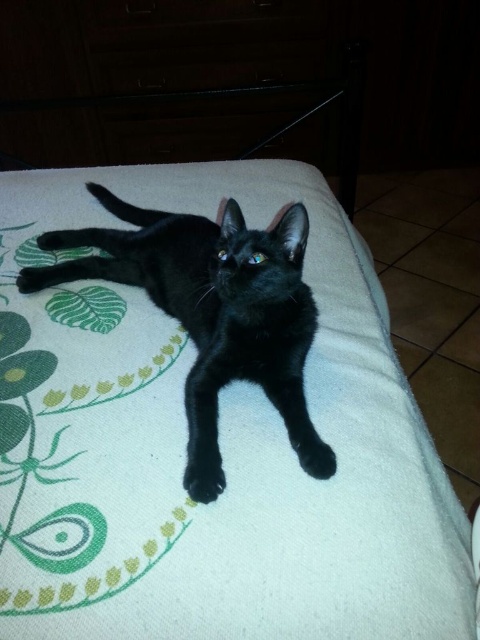
You are trying to determine if the black matte cat at center can fully lie on the white soft blanket at center without any part of its body hanging off. Based on their sizes, can it fit?

The white soft blanket at center is much taller than the black matte cat at center, so yes, the cat can fully lie on the blanket without any part hanging off.

You are a photographer setting up for a pet photo shoot. You have a white soft blanket at center and a black matte cat at center in the scene. To ensure the cat is clearly visible against the blanket, which object should be placed behind the other?

The white soft blanket at center is in front of the black matte cat at center. To make the cat visible, the blanket should be moved behind the cat so the cat is in front.

You are a pet sitter who needs to ensure the black matte cat at center is comfortable. The white soft blanket at center is available. Can the cat lie on the blanket?

The white soft blanket at center is located below black matte cat at center, so yes, the cat can lie on the blanket since it is already positioned underneath the cat.